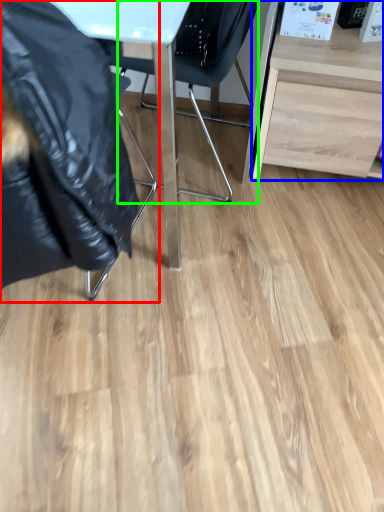
Question: Which object is positioned farthest from chair (highlighted by a red box)? Select from desk (highlighted by a blue box) and chair (highlighted by a green box).

Choices:
 (A) desk
 (B) chair

Answer: (A)